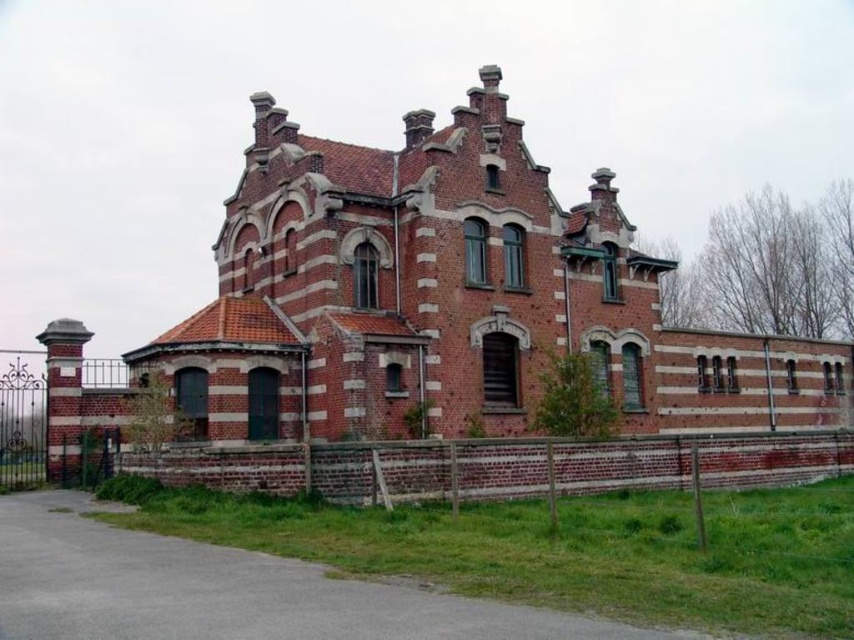
Can you confirm if brown brick wall at lower center is positioned to the right of black wrought iron gate at left?

Indeed, brown brick wall at lower center is positioned on the right side of black wrought iron gate at left.

Who is taller, brown brick wall at lower center or black wrought iron gate at left?

black wrought iron gate at left

Does point (361, 465) come behind point (48, 440)?

No.

Locate an element on the screen. The height and width of the screenshot is (640, 854). brown brick wall at lower center is located at coordinates (501, 467).